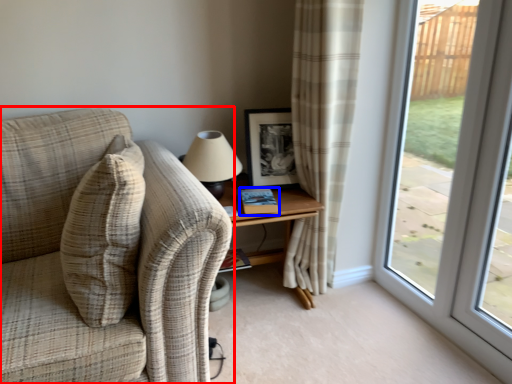
Question: Which point is closer to the camera, studio couch (highlighted by a red box) or book (highlighted by a blue box)?

Choices:
 (A) studio couch
 (B) book

Answer: (A)